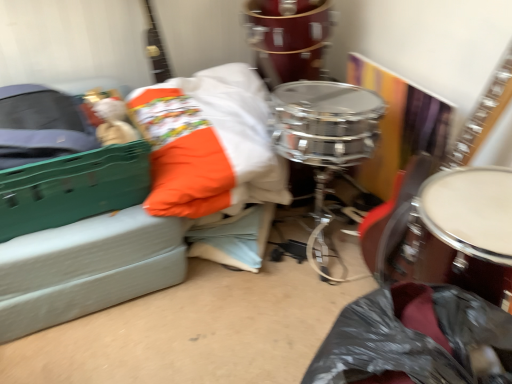
Question: Is point (266, 21) closer or farther from the camera than point (161, 62)?

Choices:
 (A) farther
 (B) closer

Answer: (B)

Question: Is shiny chrome drum at center, which is the second drum in bottom-to-top order, inside the boundaries of glossy wood guitar at upper left, acting as the 1th guitar starting from the left, or outside?

Choices:
 (A) outside
 (B) inside

Answer: (A)

Question: Based on their relative distances, which object is nearer to the shiny brown drum at right, the 2th drum viewed from the back?

Choices:
 (A) wooden acoustic guitar at center right, which is counted as the 1th guitar, starting from the right
 (B) shiny chrome drum at center, placed as the 2th drum when sorted from front to back
 (C) glossy wood guitar at upper left, acting as the 1th guitar starting from the left

Answer: (A)

Question: Estimate the real-world distances between objects in this image. Which object is closer to the wooden acoustic guitar at center right, which is counted as the 1th guitar, starting from the right?

Choices:
 (A) shiny chrome drum at center, the 1th drum viewed from the back
 (B) glossy wood guitar at upper left, the 2th guitar when ordered from right to left
 (C) shiny brown drum at right, the 1th drum from the bottom

Answer: (C)